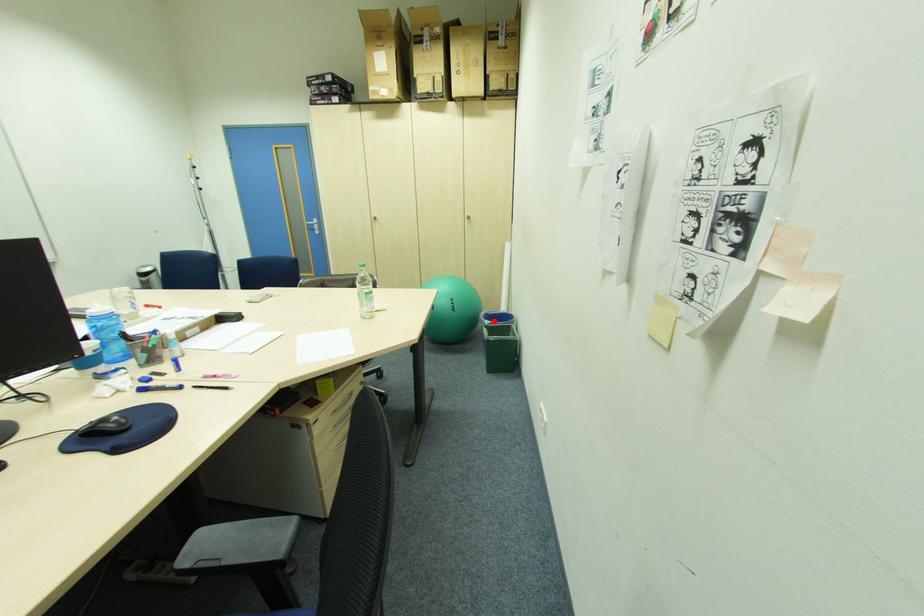
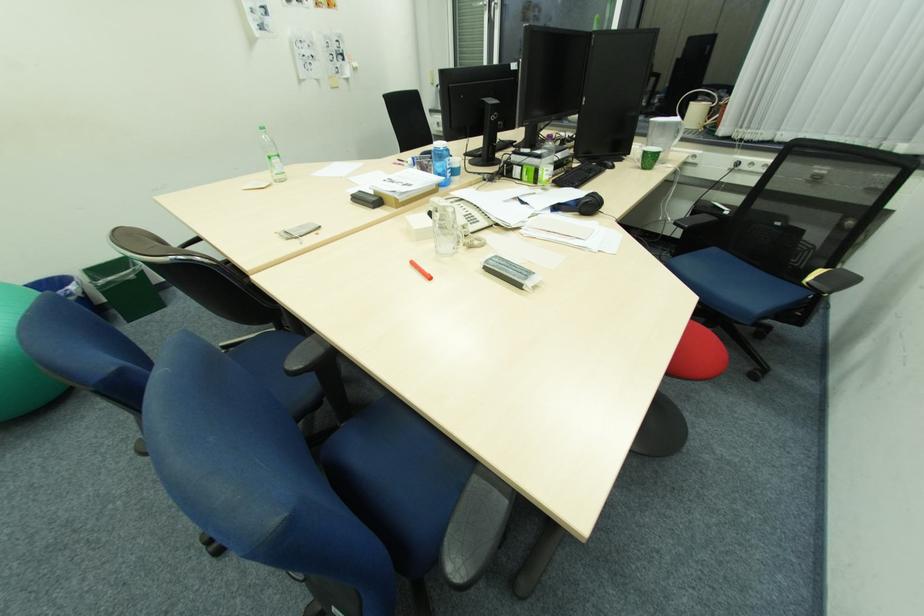
Where in the second image is the point corresponding to the highlighted location from the first image?

(73, 286)